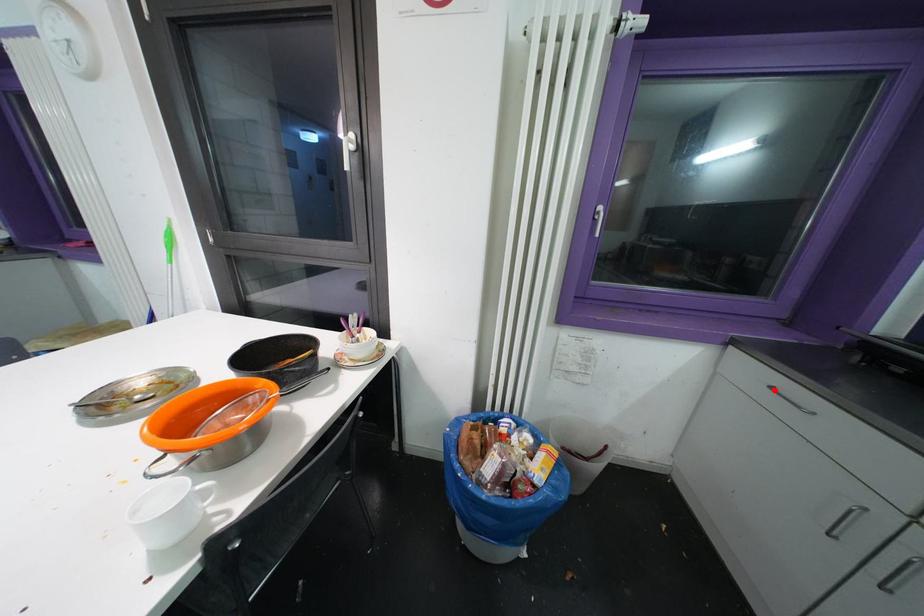
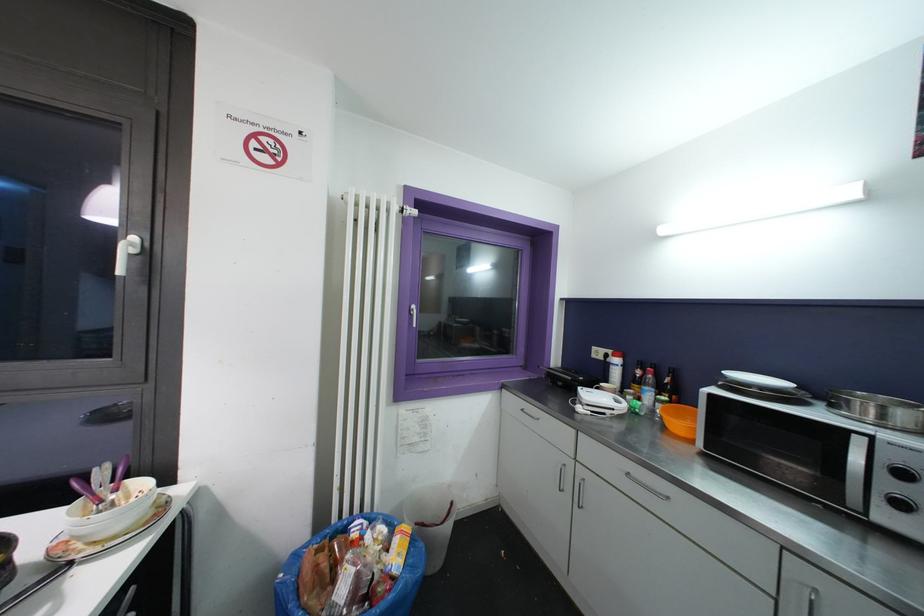
The point at the highlighted location is marked in the first image. Where is the corresponding point in the second image?

(526, 413)